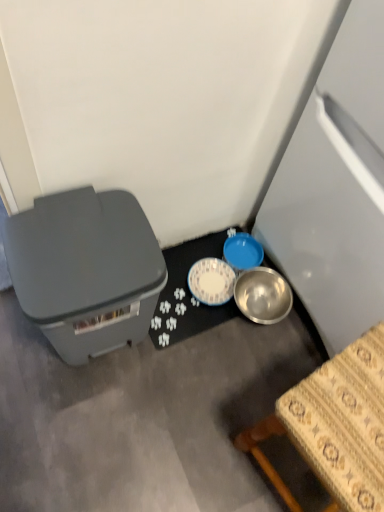
Question: Can you confirm if matte gray storage box at left is thinner than wooden table at lower right?

Choices:
 (A) yes
 (B) no

Answer: (A)

Question: Can you confirm if matte gray storage box at left is bigger than wooden table at lower right?

Choices:
 (A) no
 (B) yes

Answer: (A)

Question: From the image's perspective, would you say matte gray storage box at left is positioned over wooden table at lower right?

Choices:
 (A) yes
 (B) no

Answer: (A)

Question: Is matte gray storage box at left to the left of wooden table at lower right from the viewer's perspective?

Choices:
 (A) yes
 (B) no

Answer: (A)

Question: Would you say matte gray storage box at left contains wooden table at lower right?

Choices:
 (A) yes
 (B) no

Answer: (B)

Question: In the image, is wooden table at lower right on the left side or the right side of satin white refrigerator at right?

Choices:
 (A) left
 (B) right

Answer: (A)

Question: Does point (284, 487) appear closer or farther from the camera than point (336, 236)?

Choices:
 (A) closer
 (B) farther

Answer: (B)

Question: From their relative heights in the image, would you say wooden table at lower right is taller or shorter than satin white refrigerator at right?

Choices:
 (A) tall
 (B) short

Answer: (B)

Question: In terms of size, does wooden table at lower right appear bigger or smaller than satin white refrigerator at right?

Choices:
 (A) big
 (B) small

Answer: (B)

Question: Would you say blue plastic bowl at center-right is to the left or to the right of satin white refrigerator at right in the picture?

Choices:
 (A) left
 (B) right

Answer: (A)

Question: Considering the positions of blue plastic bowl at center-right and satin white refrigerator at right in the image, is blue plastic bowl at center-right wider or thinner than satin white refrigerator at right?

Choices:
 (A) wide
 (B) thin

Answer: (B)

Question: Is blue plastic bowl at center-right taller or shorter than satin white refrigerator at right?

Choices:
 (A) short
 (B) tall

Answer: (A)

Question: In the image, is blue plastic bowl at center-right positioned in front of or behind satin white refrigerator at right?

Choices:
 (A) behind
 (B) front

Answer: (A)

Question: Is point (337, 231) positioned closer to the camera than point (185, 245)?

Choices:
 (A) farther
 (B) closer

Answer: (B)

Question: Based on their sizes in the image, would you say satin white refrigerator at right is bigger or smaller than metallic silver bowl at lower center?

Choices:
 (A) small
 (B) big

Answer: (B)